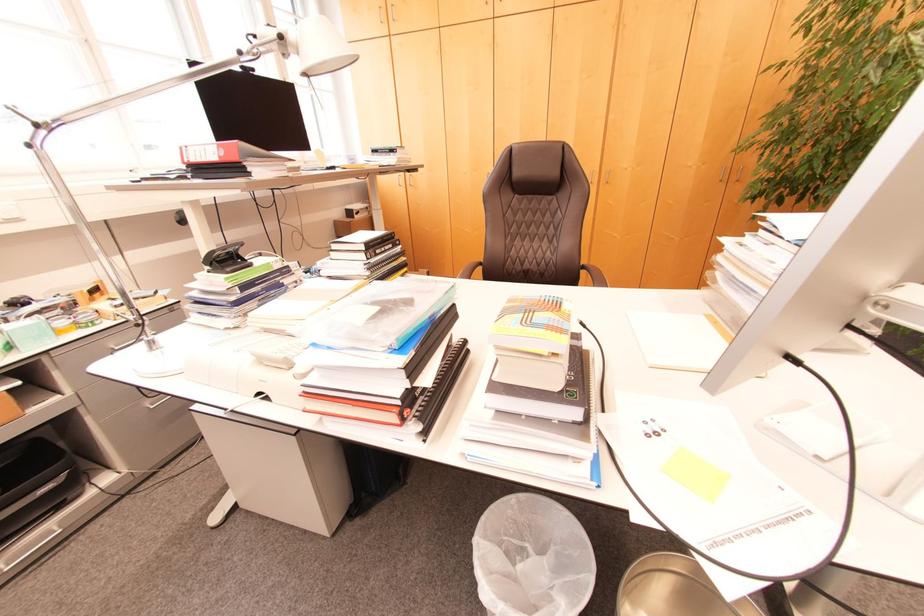
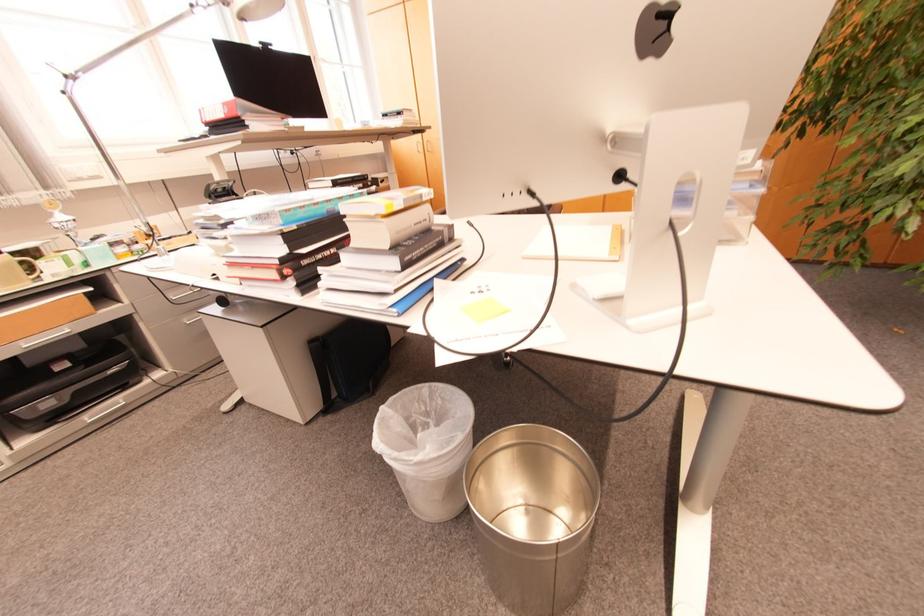
Question: Based on the continuous images, in which direction is the camera rotating? Reply with the corresponding letter.

Choices:
 (A) Left
 (B) Right
 (C) Up
 (D) Down

Answer: (A)